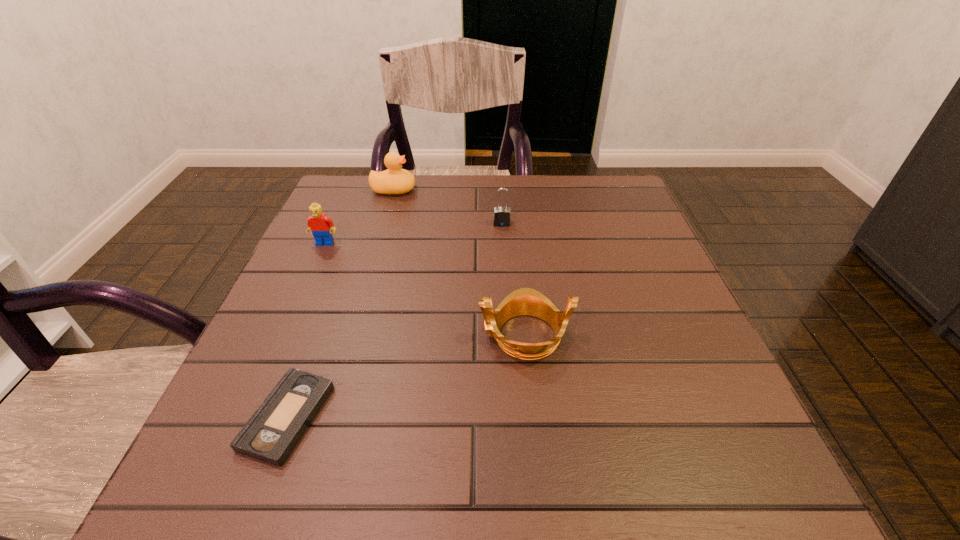
At what (x,y) coordinates should I click in order to perform the action: click on vacant space located at the front emblem of the second nearest object. Please return your answer as a coordinate pair (x, y). Looking at the image, I should click on pyautogui.click(x=429, y=335).

Identify the location of free point located 0.330m at the front emblem of the second nearest object. The image size is (960, 540). (297, 335).

Locate an element on the screen. vacant area situated on the back of the videotape is located at coordinates (344, 265).

Where is `duck situated at the far edge`? Image resolution: width=960 pixels, height=540 pixels. duck situated at the far edge is located at coordinates (394, 180).

At what (x,y) coordinates should I click in order to perform the action: click on padlock at the far edge. Please return your answer as a coordinate pair (x, y). The width and height of the screenshot is (960, 540). Looking at the image, I should click on (501, 217).

Identify the location of object located in the near edge section of the desktop. Image resolution: width=960 pixels, height=540 pixels. (270, 435).

Locate an element on the screen. The image size is (960, 540). duck at the left edge is located at coordinates (394, 180).

Where is `Lego that is at the left edge`? Image resolution: width=960 pixels, height=540 pixels. Lego that is at the left edge is located at coordinates (321, 226).

At what (x,y) coordinates should I click in order to perform the action: click on videotape situated at the left edge. Please return your answer as a coordinate pair (x, y). Looking at the image, I should click on (270, 435).

At what (x,y) coordinates should I click in order to perform the action: click on object that is positioned at the far left corner. Please return your answer as a coordinate pair (x, y). The width and height of the screenshot is (960, 540). Looking at the image, I should click on (394, 180).